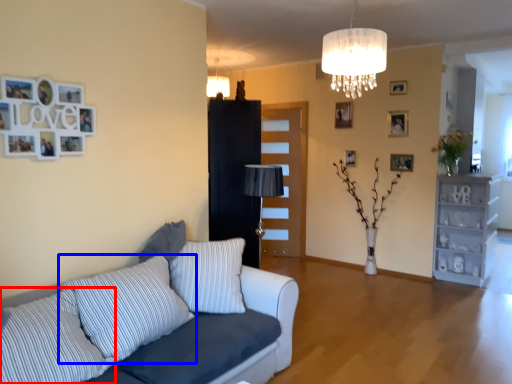
Question: Among these objects, which one is nearest to the camera, pillow (highlighted by a red box) or pillow (highlighted by a blue box)?

Choices:
 (A) pillow
 (B) pillow

Answer: (A)